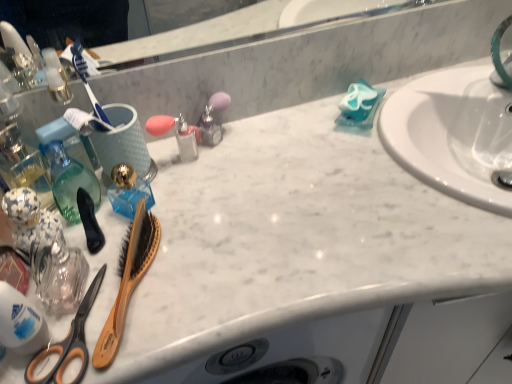
Question: Should I look upward or downward to see translucent plastic bottle at lower left, the first cleaning product positioned from the left?

Choices:
 (A) down
 (B) up

Answer: (A)

Question: Is the depth of translucent glass bottle at left less than that of orange-handled scissors at lower left?

Choices:
 (A) no
 (B) yes

Answer: (A)

Question: Would you consider translucent glass bottle at left to be distant from orange-handled scissors at lower left?

Choices:
 (A) yes
 (B) no

Answer: (B)

Question: Can you confirm if translucent glass bottle at left is bigger than orange-handled scissors at lower left?

Choices:
 (A) yes
 (B) no

Answer: (A)

Question: Is translucent glass bottle at left looking in the opposite direction of orange-handled scissors at lower left?

Choices:
 (A) no
 (B) yes

Answer: (A)

Question: From a real-world perspective, is translucent glass bottle at left positioned under orange-handled scissors at lower left based on gravity?

Choices:
 (A) yes
 (B) no

Answer: (B)

Question: From a real-world perspective, is translucent glass bottle at left located higher than orange-handled scissors at lower left?

Choices:
 (A) yes
 (B) no

Answer: (A)

Question: Would you say wooden bristle brush at left, the first brush when ordered from right to left, is part of orange-handled scissors at lower left's contents?

Choices:
 (A) yes
 (B) no

Answer: (B)

Question: From a real-world perspective, is orange-handled scissors at lower left over wooden bristle brush at left, which ranks as the 2th brush in left-to-right order?

Choices:
 (A) no
 (B) yes

Answer: (A)

Question: Does orange-handled scissors at lower left have a smaller size compared to wooden bristle brush at left, the first brush when ordered from right to left?

Choices:
 (A) no
 (B) yes

Answer: (B)

Question: Is orange-handled scissors at lower left next to wooden bristle brush at left, the first brush when ordered from right to left, and touching it?

Choices:
 (A) yes
 (B) no

Answer: (A)

Question: Is orange-handled scissors at lower left thinner than wooden bristle brush at left, the first brush when ordered from right to left?

Choices:
 (A) no
 (B) yes

Answer: (A)

Question: Is orange-handled scissors at lower left oriented away from wooden bristle brush at left, the first brush when ordered from right to left?

Choices:
 (A) yes
 (B) no

Answer: (B)

Question: From a real-world perspective, is translucent plastic bottle at lower left, acting as the first cleaning product starting from the front, positioned over translucent blue glass at center based on gravity?

Choices:
 (A) yes
 (B) no

Answer: (A)